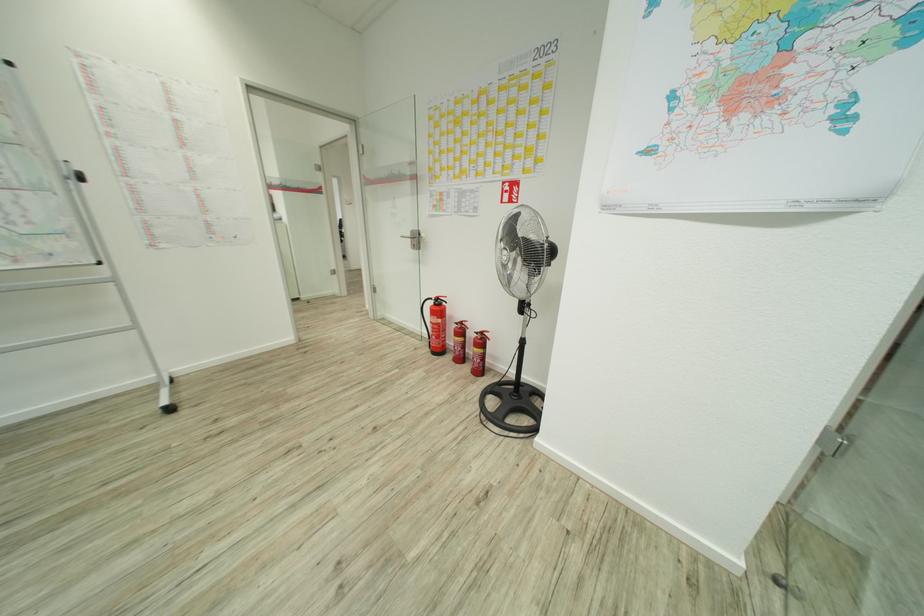
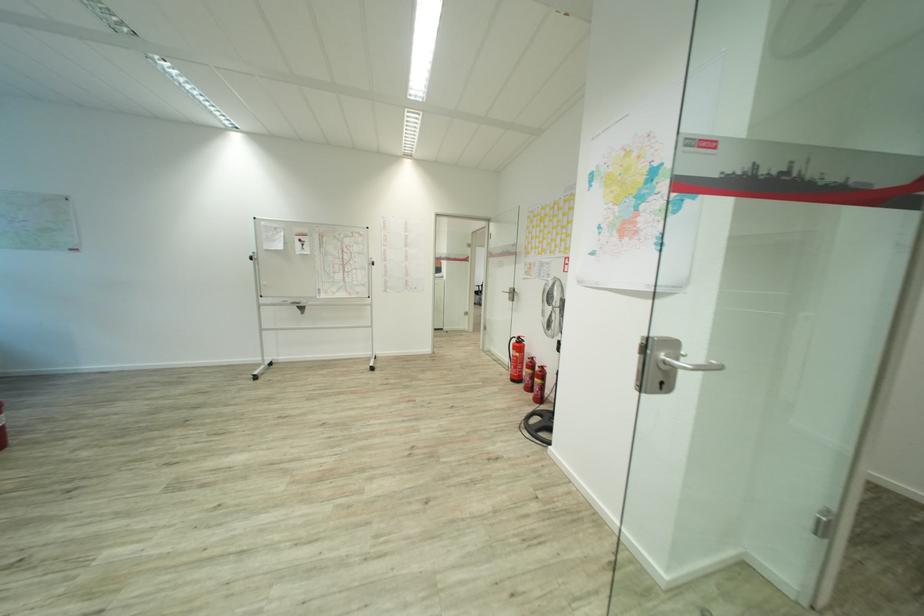
Question: The first image is from the beginning of the video and the second image is from the end. How did the camera likely rotate when shooting the video?

Choices:
 (A) Left
 (B) Right
 (C) Up
 (D) Down

Answer: (A)